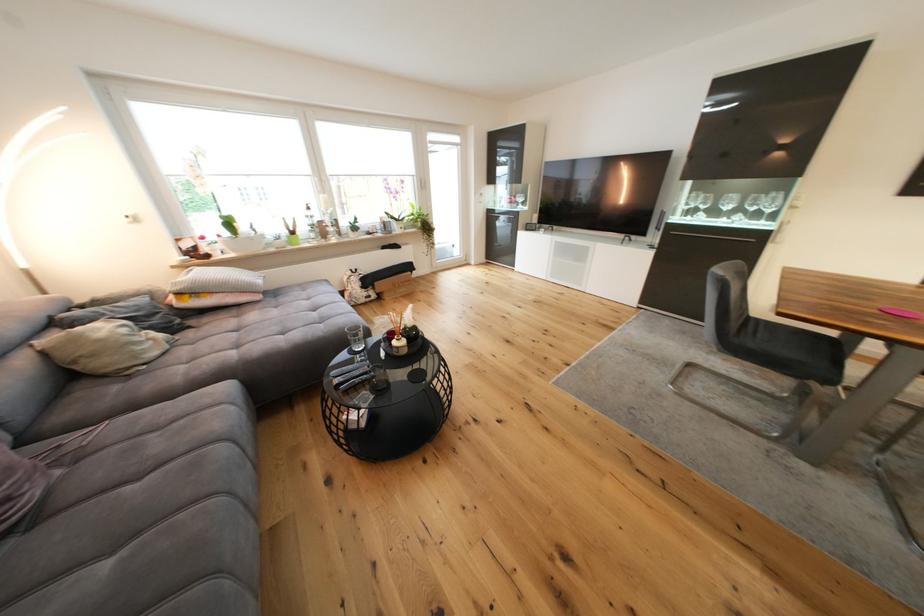
Find where to drink the drinking glass. Please return your answer as a coordinate pair (x, y).

(355, 338)